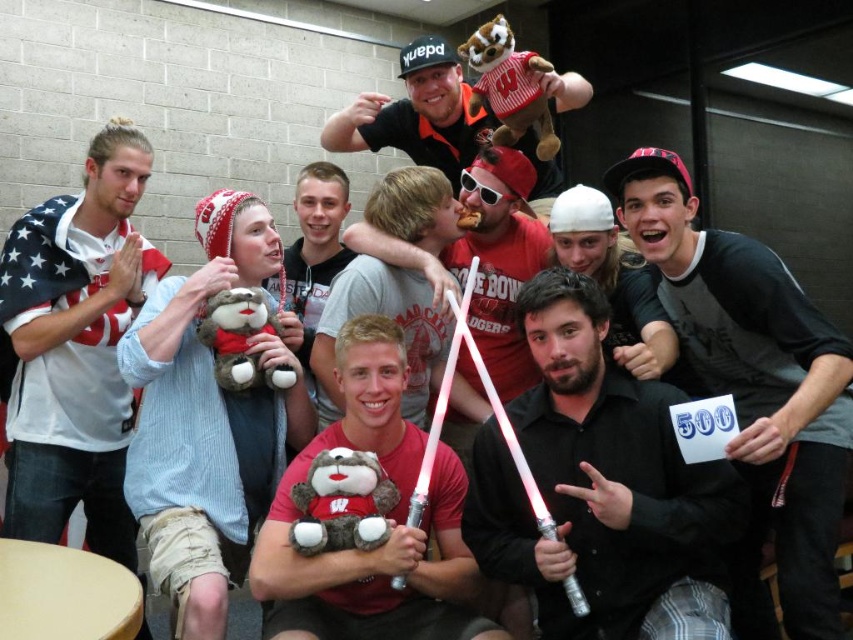
How distant is soft plush bear at center from black matte cap at upper center?

soft plush bear at center and black matte cap at upper center are 4.11 feet apart from each other.

Which is in front, point (294, 593) or point (541, 184)?

Point (294, 593) is in front.

Locate an element on the screen. The image size is (853, 640). soft plush bear at center is located at coordinates (386, 516).

In the scene shown: Can you confirm if white cotton shirt at left is bigger than soft plush bear at center?

Yes, white cotton shirt at left is bigger than soft plush bear at center.

Which is behind, point (62, 342) or point (339, 588)?

Point (62, 342)

This screenshot has height=640, width=853. I want to click on white cotton shirt at left, so [74, 348].

Who is lower down, black jersey at upper right or soft plush bear at center?

soft plush bear at center is lower down.

Between point (805, 618) and point (369, 561), which one is positioned in front?

Point (805, 618)

Image resolution: width=853 pixels, height=640 pixels. What are the coordinates of `black jersey at upper right` in the screenshot? It's located at (753, 388).